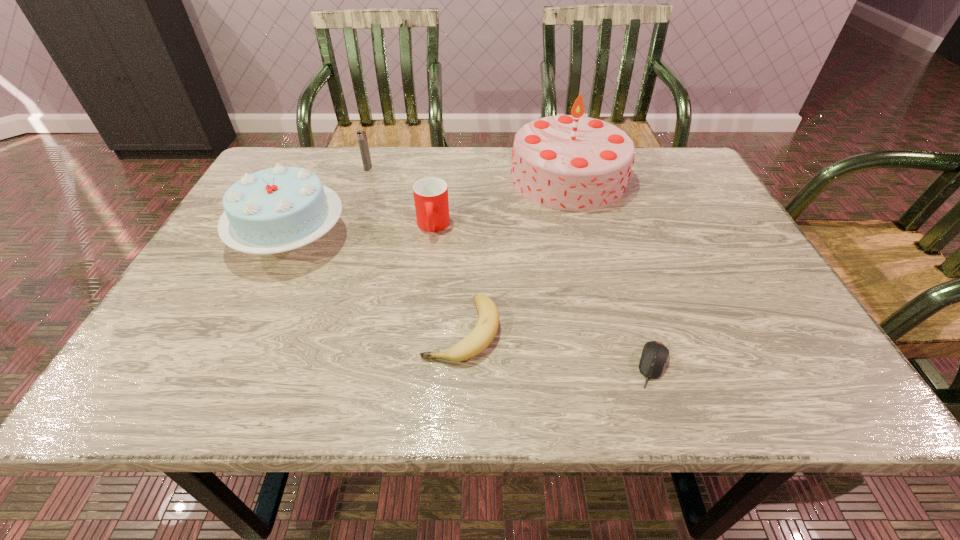
This screenshot has width=960, height=540. Identify the location of free space between the igniter and the tallest object. (468, 173).

The image size is (960, 540). I want to click on empty space between the cup and the shorter birthday cake, so click(x=362, y=232).

You are a GUI agent. You are given a task and a screenshot of the screen. Output one action in this format:
    pyautogui.click(x=<x>, y=<y>)
    Task: Click on the free space between the fifth tallest object and the cup
    
    Given the screenshot: What is the action you would take?
    pyautogui.click(x=447, y=278)

Where is `vacant region between the igniter and the cup`? vacant region between the igniter and the cup is located at coordinates (400, 197).

Find the location of `vacant space that's between the computer mouse and the shorter birthday cake`. vacant space that's between the computer mouse and the shorter birthday cake is located at coordinates (472, 301).

This screenshot has height=540, width=960. I want to click on the closest object to the cup, so click(571, 162).

Where is `object that can be found as the third closest to the igniter`? object that can be found as the third closest to the igniter is located at coordinates (571, 162).

The width and height of the screenshot is (960, 540). What are the coordinates of `free space that satisfies the following two spatial constraints: 1. on the front side of the taller birthday cake; 2. on the left side of the shortest object` in the screenshot? It's located at (617, 365).

You are a GUI agent. You are given a task and a screenshot of the screen. Output one action in this format:
    pyautogui.click(x=<x>, y=<y>)
    Task: Click on the vacant area that satisfies the following two spatial constraints: 1. on the front side of the tallest object; 2. on the left side of the igniter
    The image size is (960, 540).
    Given the screenshot: What is the action you would take?
    pyautogui.click(x=365, y=178)

Identify the location of free space that satisfies the following two spatial constraints: 1. on the back side of the banana; 2. on the left side of the right birthday cake. Image resolution: width=960 pixels, height=540 pixels. (467, 178).